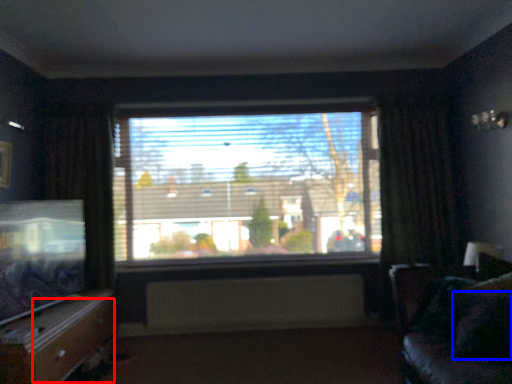
Question: Among these objects, which one is farthest to the camera, drawer (highlighted by a red box) or pillow (highlighted by a blue box)?

Choices:
 (A) drawer
 (B) pillow

Answer: (A)